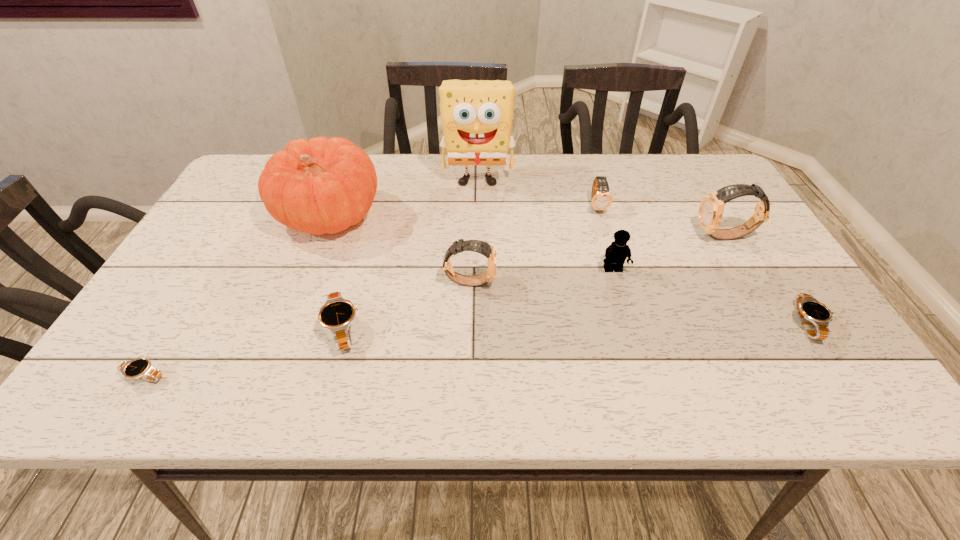
Identify which gold watch is the second nearest to the yellow Lego. Please provide its 2D coordinates. Your answer should be formatted as a tuple, i.e. [(x, y)], where the tuple contains the x and y coordinates of a point satisfying the conditions above.

[(710, 212)]

You are a GUI agent. You are given a task and a screenshot of the screen. Output one action in this format:
    pyautogui.click(x=<x>, y=<y>)
    Task: Click on the black watch that is the third nearest to the tallest object
    
    Given the screenshot: What is the action you would take?
    click(141, 368)

Where is `black watch that is the third closest to the farthest gold watch`? The image size is (960, 540). black watch that is the third closest to the farthest gold watch is located at coordinates (141, 368).

You are a GUI agent. You are given a task and a screenshot of the screen. Output one action in this format:
    pyautogui.click(x=<x>, y=<y>)
    Task: Click on the free location that satisfies the following two spatial constraints: 1. on the front side of the eighth shortest object; 2. on the right side of the third shortest watch
    This screenshot has width=960, height=540.
    Given the screenshot: What is the action you would take?
    pyautogui.click(x=287, y=329)

This screenshot has height=540, width=960. Identify the location of free space that satisfies the following two spatial constraints: 1. on the back side of the eighth tallest object; 2. on the face of the third farthest watch. (x=780, y=281).

The image size is (960, 540). I want to click on vacant space that satisfies the following two spatial constraints: 1. on the face of the eighth tallest object; 2. on the right side of the second nearest gold watch, so click(x=776, y=323).

Identify the location of free location that satisfies the following two spatial constraints: 1. on the face of the third tallest watch; 2. on the face of the fourth nearest watch. (619, 281).

The height and width of the screenshot is (540, 960). What are the coordinates of `free spot that satisfies the following two spatial constraints: 1. on the front-facing side of the Lego; 2. on the right side of the second shortest watch` in the screenshot? It's located at (629, 323).